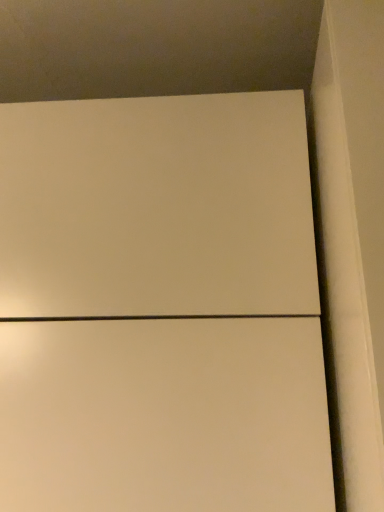
This screenshot has height=512, width=384. Describe the element at coordinates (160, 307) in the screenshot. I see `matte white cabinet at center` at that location.

At what (x,y) coordinates should I click in order to perform the action: click on matte white cabinet at center. Please return your answer as a coordinate pair (x, y). The height and width of the screenshot is (512, 384). Looking at the image, I should click on (160, 307).

Locate an element on the screen. This screenshot has width=384, height=512. matte white cabinet at center is located at coordinates (160, 307).